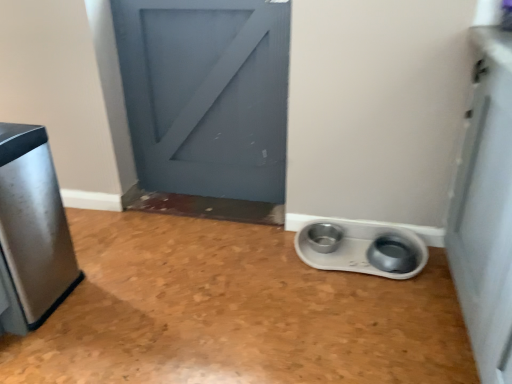
This screenshot has height=384, width=512. I want to click on free space to the back side of brushed metal trash can at left, so (95, 236).